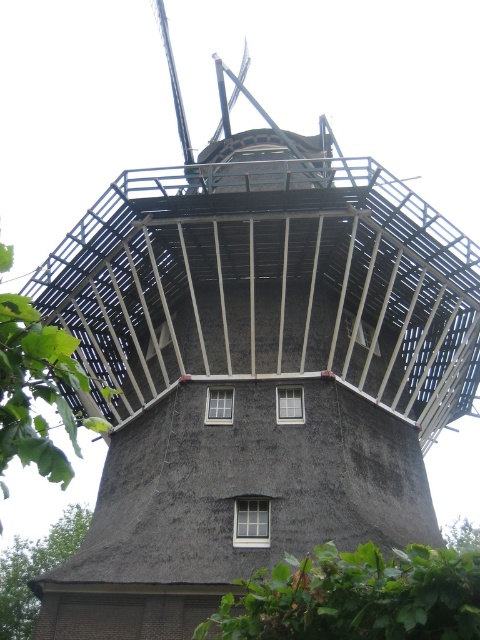
In the scene shown: Who is higher up, green leafy tree at upper left or green thatch roof at lower left?

Positioned higher is green leafy tree at upper left.

Is green leafy tree at upper left to the left of green thatch roof at lower left from the viewer's perspective?

In fact, green leafy tree at upper left is to the right of green thatch roof at lower left.

Describe the element at coordinates (37, 388) in the screenshot. I see `green leafy tree at upper left` at that location.

Image resolution: width=480 pixels, height=640 pixels. I want to click on green leafy tree at upper left, so click(x=37, y=388).